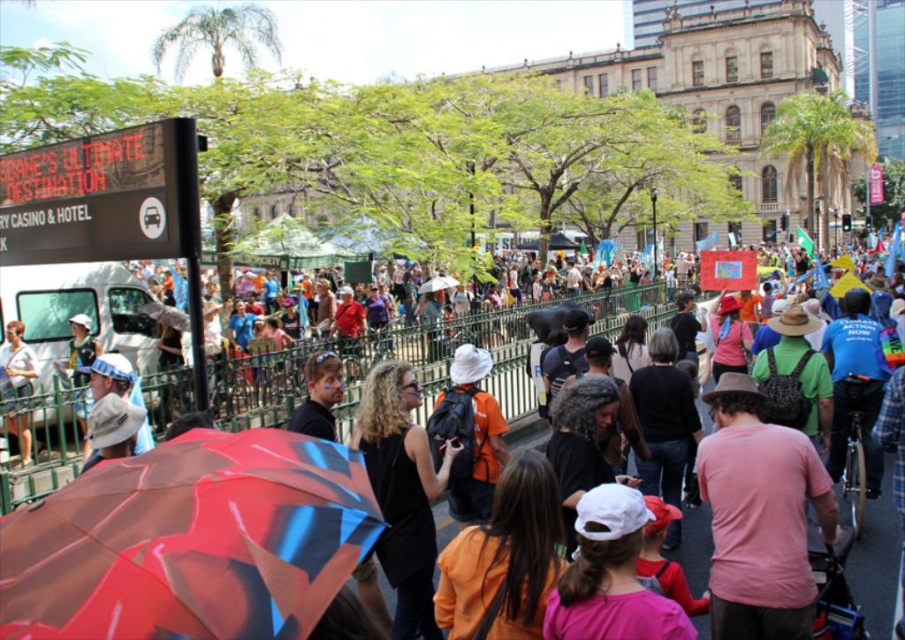
Question: Which object appears closest to the camera in this image?

Choices:
 (A) matte black tank top at lower left
 (B) orange matte shirt at center

Answer: (B)

Question: Which of these objects is positioned closest to the black matte dress at center?

Choices:
 (A) orange matte shirt at center
 (B) shiny plastic umbrella at center
 (C) pink matte t-shirt at center
 (D) matte black tank top at lower left

Answer: (A)

Question: Does shiny plastic umbrella at center have a larger size compared to matte black tank top at lower left?

Choices:
 (A) no
 (B) yes

Answer: (B)

Question: Does pink matte t-shirt at center appear over orange matte shirt at center?

Choices:
 (A) yes
 (B) no

Answer: (B)

Question: Can you confirm if shiny plastic umbrella at center is positioned above orange matte shirt at center?

Choices:
 (A) no
 (B) yes

Answer: (A)

Question: Estimate the real-world distances between objects in this image. Which object is closer to the orange matte shirt at center?

Choices:
 (A) black matte dress at center
 (B) shiny plastic umbrella at center
 (C) matte black tank top at lower left
 (D) pink matte t-shirt at center

Answer: (A)